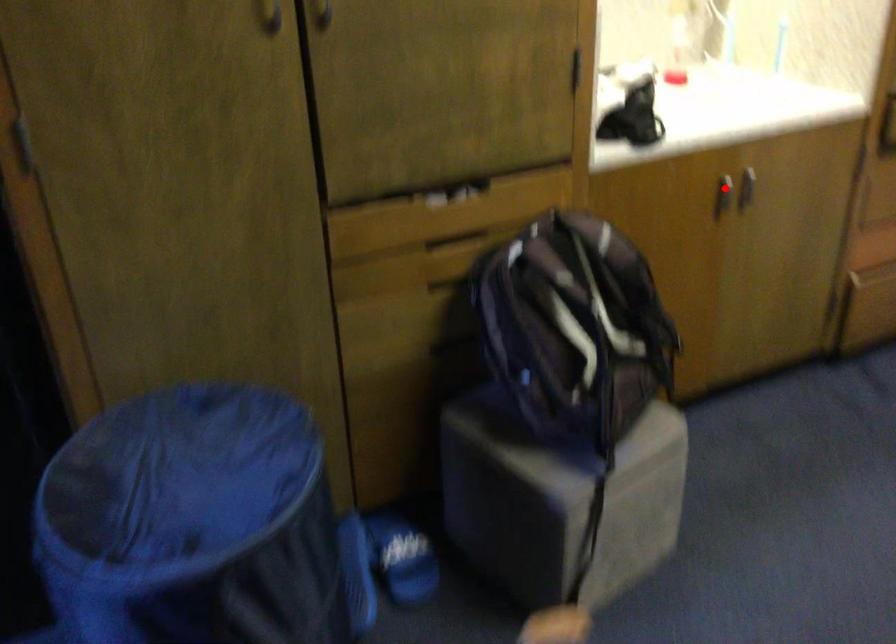
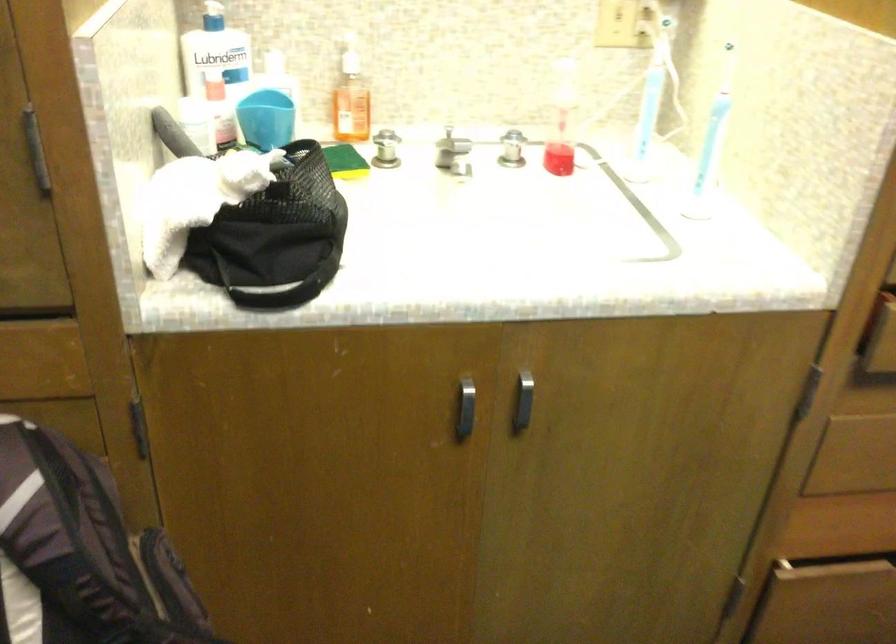
Find the pixel in the second image that matches the highlighted location in the first image.

(464, 409)